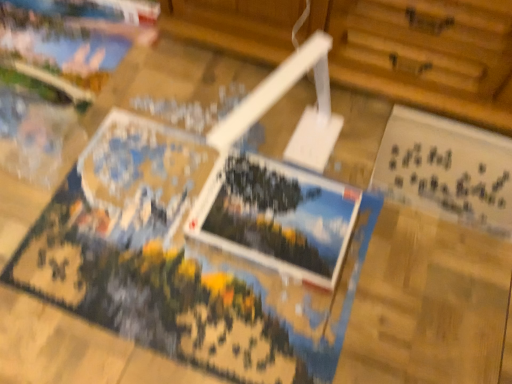
Where is `vacant space situated above printed paper postcard at center, positioned as the first postcard in left-to-right order (from a real-world perspective)`? The image size is (512, 384). vacant space situated above printed paper postcard at center, positioned as the first postcard in left-to-right order (from a real-world perspective) is located at coordinates (274, 213).